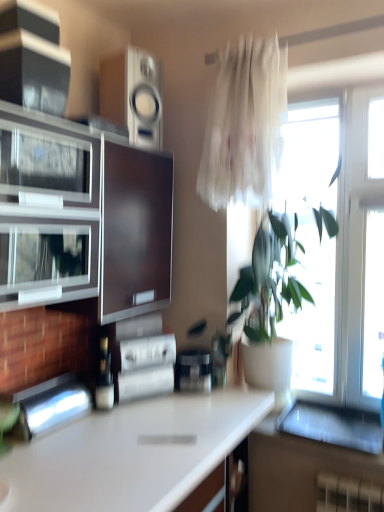
Question: Can you confirm if black glossy speaker at upper left, acting as the second appliance starting from the top, is positioned to the right of metallic stainless steel toaster at lower left, which is the 5th appliance from top to bottom?

Choices:
 (A) yes
 (B) no

Answer: (B)

Question: Are black glossy speaker at upper left, marked as the 4th appliance in a bottom-to-top arrangement, and metallic stainless steel toaster at lower left, which is the 5th appliance from top to bottom, far apart?

Choices:
 (A) yes
 (B) no

Answer: (A)

Question: Can you confirm if black glossy speaker at upper left, marked as the 4th appliance in a bottom-to-top arrangement, is shorter than metallic stainless steel toaster at lower left, which is the 5th appliance from top to bottom?

Choices:
 (A) no
 (B) yes

Answer: (A)

Question: Could metallic stainless steel toaster at lower left, which is the 5th appliance from top to bottom, be considered to be inside black glossy speaker at upper left, marked as the 4th appliance in a bottom-to-top arrangement?

Choices:
 (A) yes
 (B) no

Answer: (B)

Question: Is black glossy speaker at upper left, marked as the 4th appliance in a bottom-to-top arrangement, further to camera compared to metallic stainless steel toaster at lower left, which ranks as the first appliance in bottom-to-top order?

Choices:
 (A) no
 (B) yes

Answer: (A)

Question: From a real-world perspective, is black glossy speaker at upper left, acting as the second appliance starting from the top, over metallic stainless steel toaster at lower left, which ranks as the first appliance in bottom-to-top order?

Choices:
 (A) no
 (B) yes

Answer: (B)

Question: Is white glossy countertop at center outside of black glossy speaker at upper left, acting as the second appliance starting from the top?

Choices:
 (A) yes
 (B) no

Answer: (A)

Question: Considering the relative sizes of white glossy countertop at center and black glossy speaker at upper left, acting as the second appliance starting from the top, in the image provided, is white glossy countertop at center smaller than black glossy speaker at upper left, acting as the second appliance starting from the top,?

Choices:
 (A) no
 (B) yes

Answer: (A)

Question: From the image's perspective, is white glossy countertop at center under black glossy speaker at upper left, marked as the 4th appliance in a bottom-to-top arrangement?

Choices:
 (A) yes
 (B) no

Answer: (A)

Question: Could you tell me if white glossy countertop at center is turned towards black glossy speaker at upper left, marked as the 4th appliance in a bottom-to-top arrangement?

Choices:
 (A) no
 (B) yes

Answer: (A)

Question: Does white glossy countertop at center have a greater width compared to black glossy speaker at upper left, marked as the 4th appliance in a bottom-to-top arrangement?

Choices:
 (A) no
 (B) yes

Answer: (B)

Question: From the image's perspective, does white glossy countertop at center appear higher than black glossy speaker at upper left, acting as the second appliance starting from the top?

Choices:
 (A) yes
 (B) no

Answer: (B)

Question: Does shiny metallic bottle at center have a lesser height compared to black glossy speaker at upper left, marked as the 4th appliance in a bottom-to-top arrangement?

Choices:
 (A) no
 (B) yes

Answer: (A)